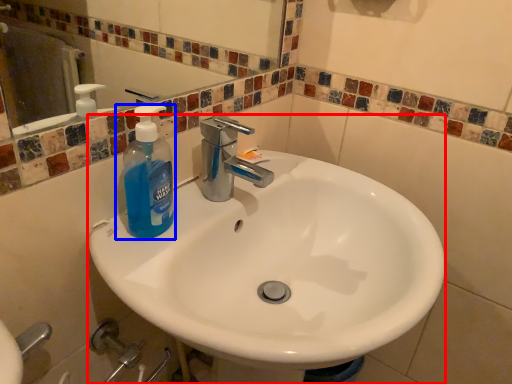
Question: Which object is further to the camera taking this photo, sink (highlighted by a red box) or bottle (highlighted by a blue box)?

Choices:
 (A) sink
 (B) bottle

Answer: (B)